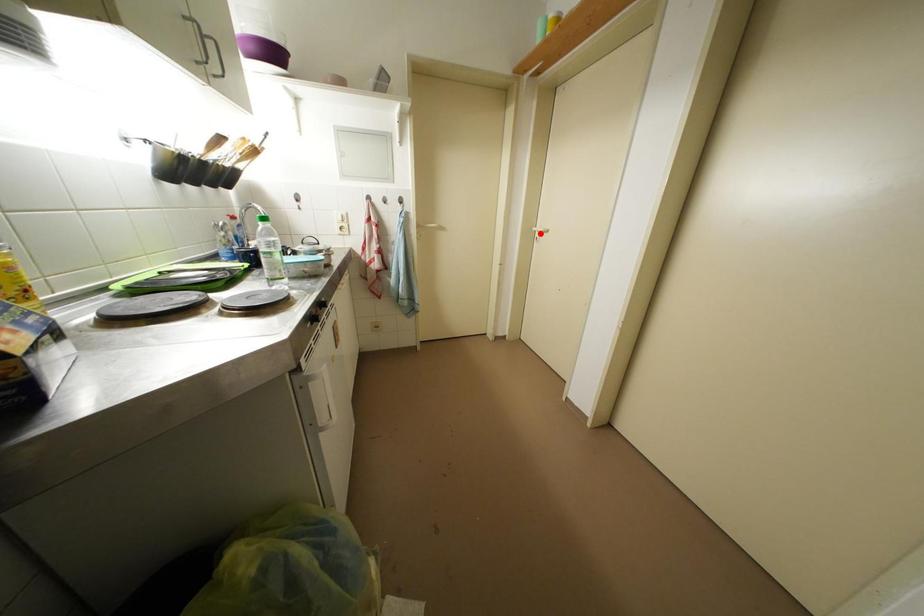
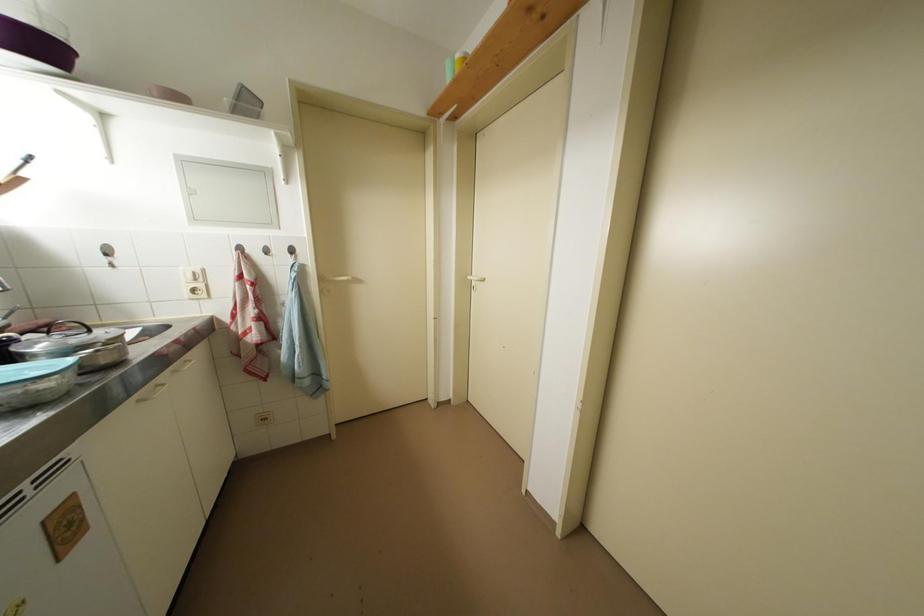
Where in the second image is the point corresponding to the highlighted location from the first image?

(476, 282)